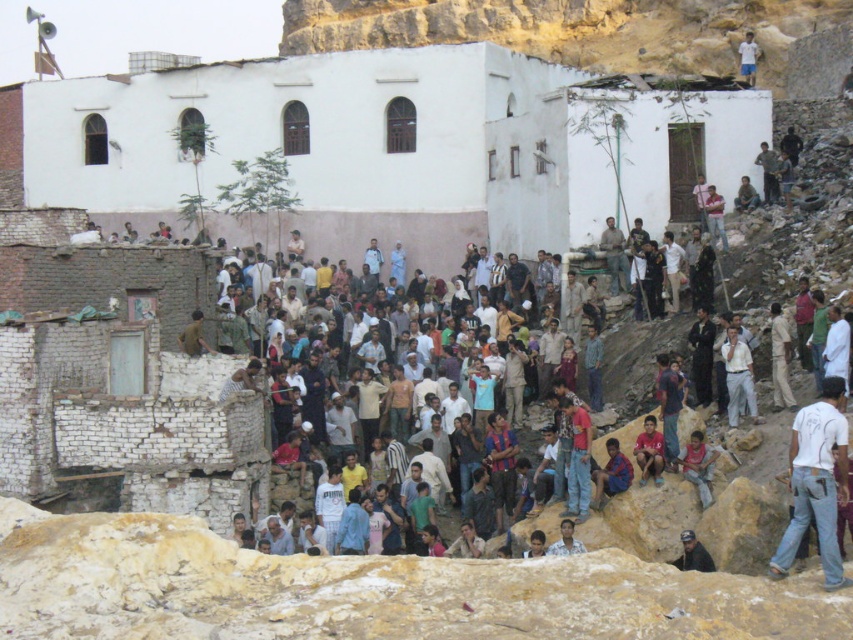
You are a photographer standing at the base of the rocky terrain. You want to capture both the light brown leather jacket at upper right and the light blue shirt at center in a single shot. Which object should you focus on first to ensure both are in frame?

You should focus on the light brown leather jacket at upper right first because it is closer to you than the light blue shirt at center, so adjusting the camera to include it will naturally include the farther object as well.

You are a photographer trying to capture both the light brown leather jacket at upper right and the light blue shirt at center in a single frame. Given their sizes, which one might you need to position closer to the camera to ensure both are clearly visible?

The light brown leather jacket at upper right has a lesser width compared to the light blue shirt at center. To ensure both are clearly visible, you should position the light brown leather jacket at upper right closer to the camera since it is smaller in size and needs to be magnified to match the visual prominence of the light blue shirt at center.

You are a photographer trying to capture a photo of the light brown fabric shirt at lower right and the light blue shirt at center. From your current position, which of the two shirts is positioned higher in the frame?

The light brown fabric shirt at lower right is positioned above the light blue shirt at center, so it is higher in the frame.